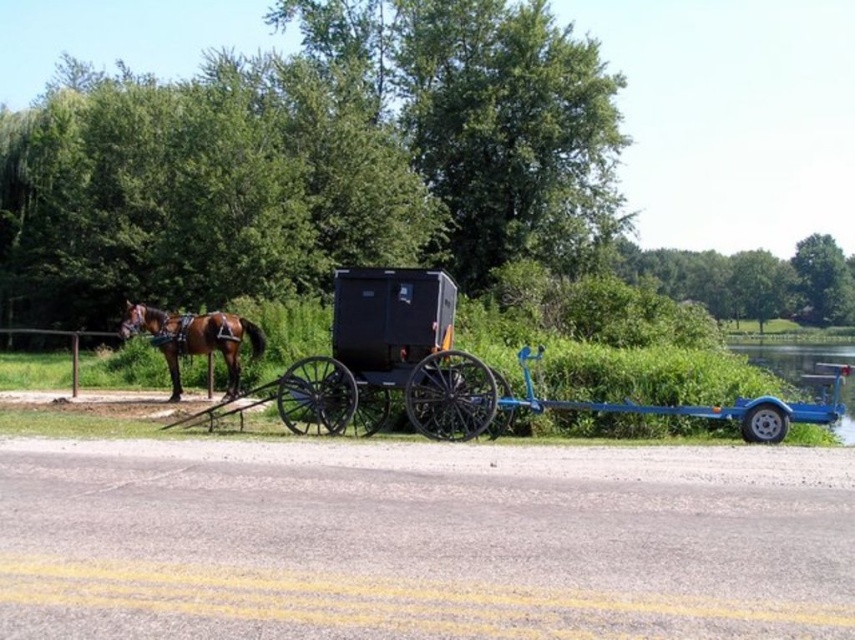
Which is more to the left, black wooden horse cart at center or brown glossy horse at left?

brown glossy horse at left

Does black wooden horse cart at center lie in front of brown glossy horse at left?

That is True.

Which is in front, point (431, 346) or point (210, 348)?

Point (431, 346) is in front.

Where is `black wooden horse cart at center`? black wooden horse cart at center is located at coordinates (453, 372).